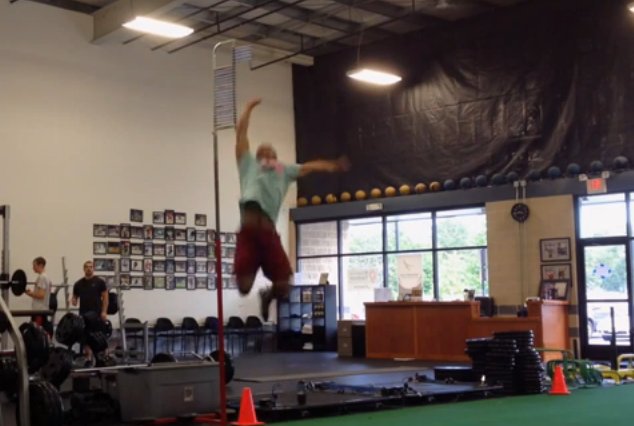
Image resolution: width=634 pixels, height=426 pixels. I want to click on green floorpads, so click(x=492, y=402).